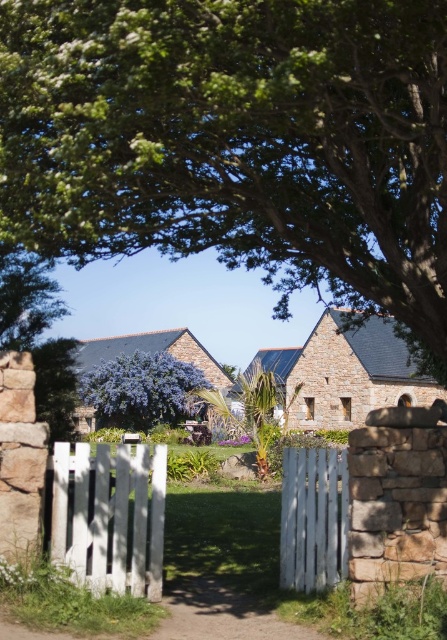
Question: Is purple leafy bush at center bigger than green leafy palm at center?

Choices:
 (A) yes
 (B) no

Answer: (B)

Question: Which of the following is the closest to the observer?

Choices:
 (A) white wooden gate at center
 (B) green leafy tree at upper center
 (C) green leafy tree at upper left
 (D) green leafy palm at center

Answer: (B)

Question: Does white wooden fence at center appear under purple leafy bush at center?

Choices:
 (A) no
 (B) yes

Answer: (A)

Question: Can you confirm if white wooden fence at center is positioned to the right of green leafy palm at center?

Choices:
 (A) no
 (B) yes

Answer: (B)

Question: Which of the following is the farthest from the observer?

Choices:
 (A) (139, 387)
 (B) (181, 234)
 (C) (28, 339)

Answer: (A)

Question: Among these objects, which one is nearest to the camera?

Choices:
 (A) white wooden gate at center
 (B) green leafy tree at upper center
 (C) white wooden fence at center
 (D) green leafy palm at center

Answer: (B)